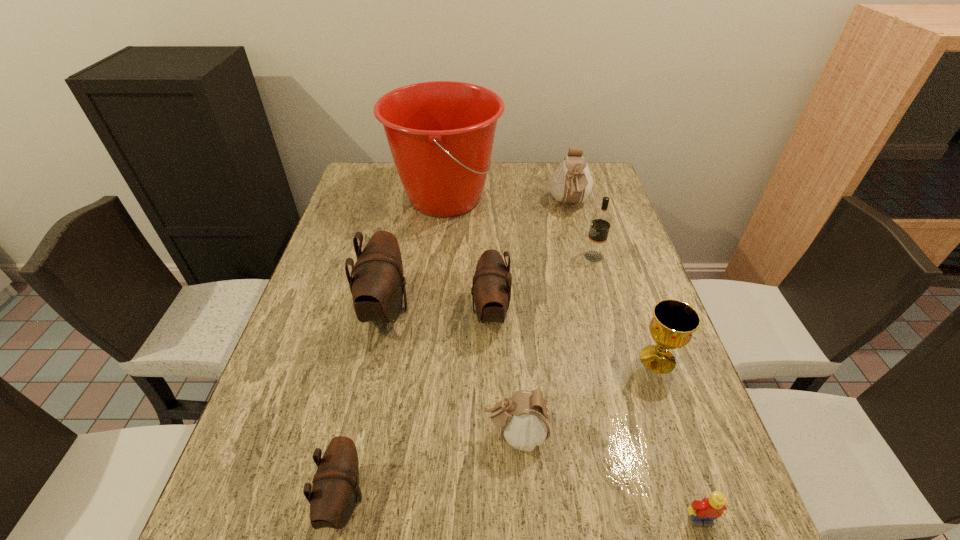
Locate an element on the screen. vacant point located between the gold chalice and the tallest object is located at coordinates (551, 279).

Identify the location of unoccupied position between the gold chalice and the rightmost brown pouch. tap(574, 336).

The image size is (960, 540). Find the location of `blank region between the bigger white pouch and the biggest brown pouch`. blank region between the bigger white pouch and the biggest brown pouch is located at coordinates (478, 256).

The width and height of the screenshot is (960, 540). I want to click on blank region between the third farthest object and the fourth farthest pouch, so click(x=555, y=346).

The width and height of the screenshot is (960, 540). I want to click on free space between the farther white pouch and the yellow Lego, so click(635, 362).

Locate an element on the screen. The height and width of the screenshot is (540, 960). vacant space that's between the bigger white pouch and the seventh farthest object is located at coordinates (542, 319).

In order to click on object that is the fourth closest one to the bucket in this screenshot , I will do `click(594, 251)`.

Identify the location of the fourth closest object to the rightmost brown pouch. The height and width of the screenshot is (540, 960). (594, 251).

Locate which pouch is the closest to the nearest brown pouch. Please provide its 2D coordinates. Your answer should be formatted as a tuple, i.e. [(x, y)], where the tuple contains the x and y coordinates of a point satisfying the conditions above.

[(524, 421)]

The width and height of the screenshot is (960, 540). In order to click on the closest pouch to the chalice in this screenshot , I will do `click(524, 421)`.